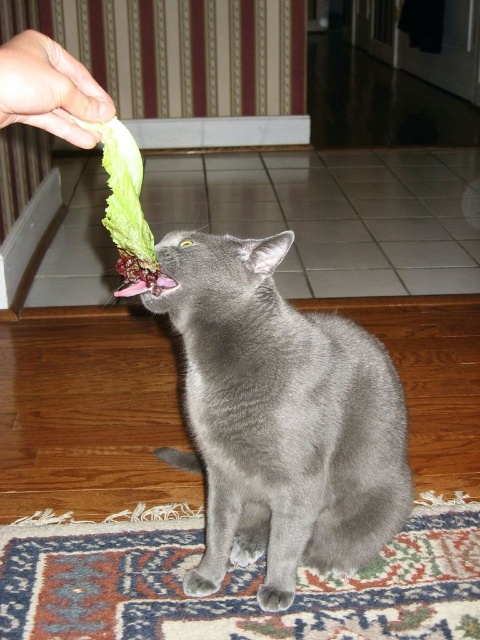
Can you confirm if smooth skin hand at upper left is positioned to the right of pink glossy lips at center?

Incorrect, smooth skin hand at upper left is not on the right side of pink glossy lips at center.

What do you see at coordinates (49, 90) in the screenshot? This screenshot has height=640, width=480. I see `smooth skin hand at upper left` at bounding box center [49, 90].

Between point (87, 81) and point (156, 292), which one is positioned behind?

Positioned behind is point (156, 292).

Identify the location of smooth skin hand at upper left. The height and width of the screenshot is (640, 480). pos(49,90).

Can you confirm if smooth gray cat at center is wider than smooth skin hand at upper left?

Indeed, smooth gray cat at center has a greater width compared to smooth skin hand at upper left.

Locate an element on the screen. This screenshot has height=640, width=480. smooth gray cat at center is located at coordinates (279, 419).

Locate an element on the screen. This screenshot has width=480, height=640. smooth gray cat at center is located at coordinates (279, 419).

Between smooth gray cat at center and green leafy lettuce at upper left, which one appears on the left side from the viewer's perspective?

From the viewer's perspective, green leafy lettuce at upper left appears more on the left side.

Is smooth gray cat at center behind green leafy lettuce at upper left?

Yes.

What do you see at coordinates (279, 419) in the screenshot? Image resolution: width=480 pixels, height=640 pixels. I see `smooth gray cat at center` at bounding box center [279, 419].

Locate an element on the screen. This screenshot has height=640, width=480. smooth gray cat at center is located at coordinates (279, 419).